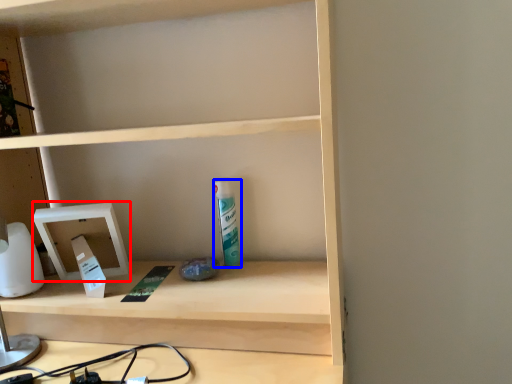
Question: Which point is closer to the camera, medicine cabinet (highlighted by a red box) or toiletry (highlighted by a blue box)?

Choices:
 (A) medicine cabinet
 (B) toiletry

Answer: (A)